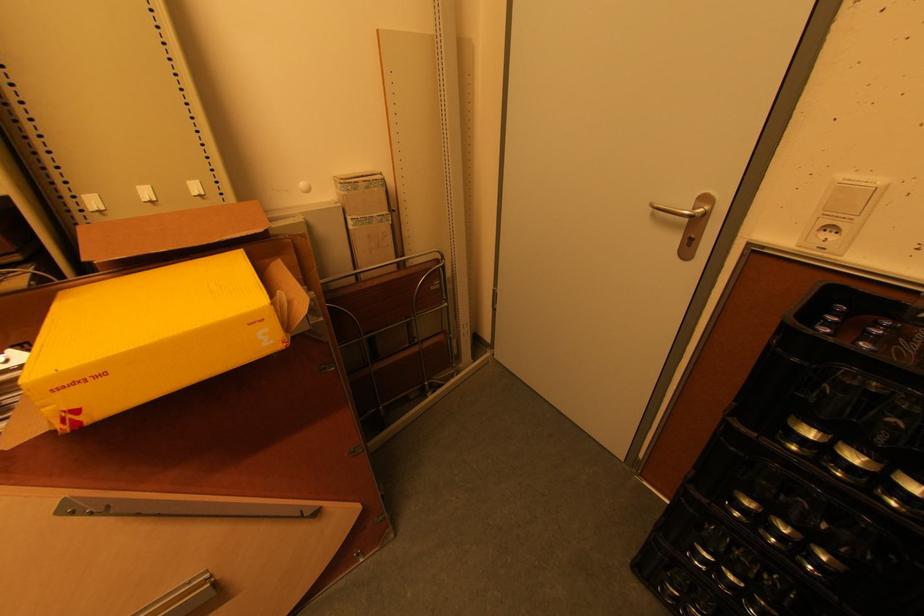
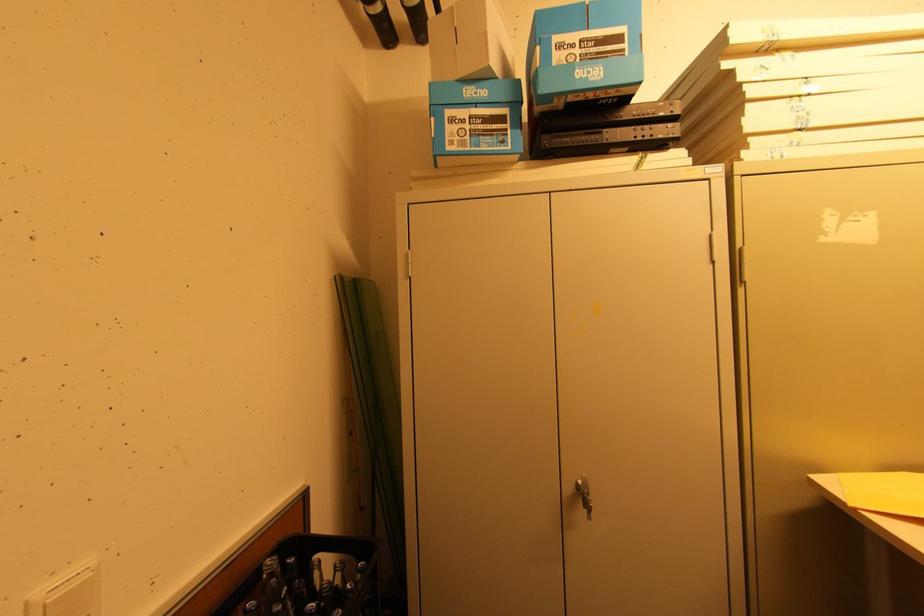
The point at (885, 180) is marked in the first image. Where is the corresponding point in the second image?

(91, 562)